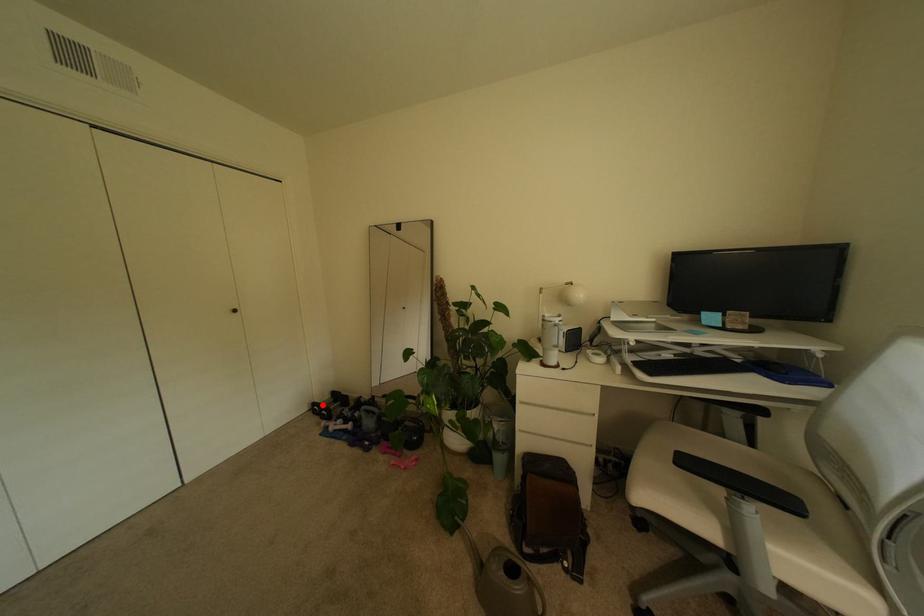
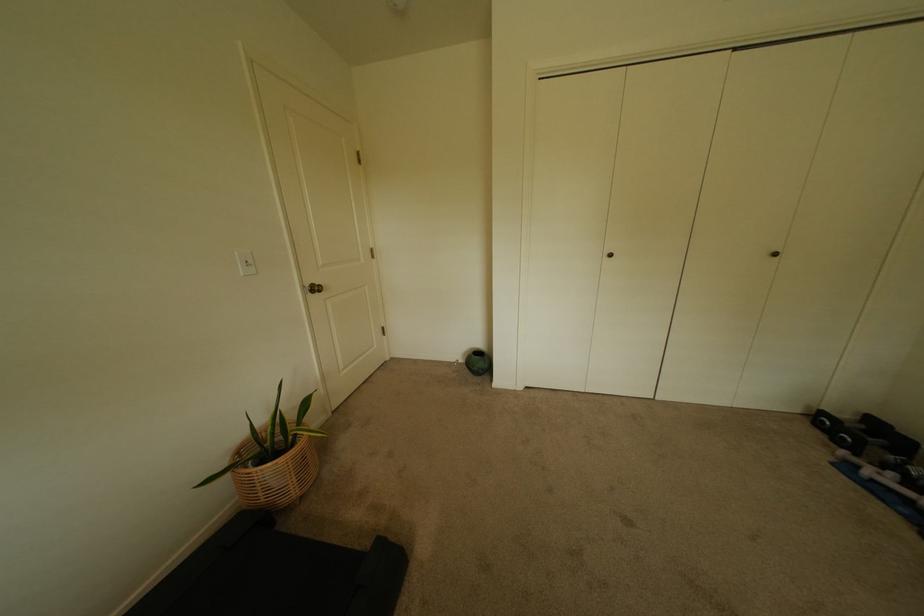
Question: I am providing you with two images of the same scene from different viewpoints. Image1 has a red point marked. In image2, the corresponding 3D location appears at what relative position? Reply with the corresponding letter.

Choices:
 (A) Closer
 (B) Farther

Answer: (B)